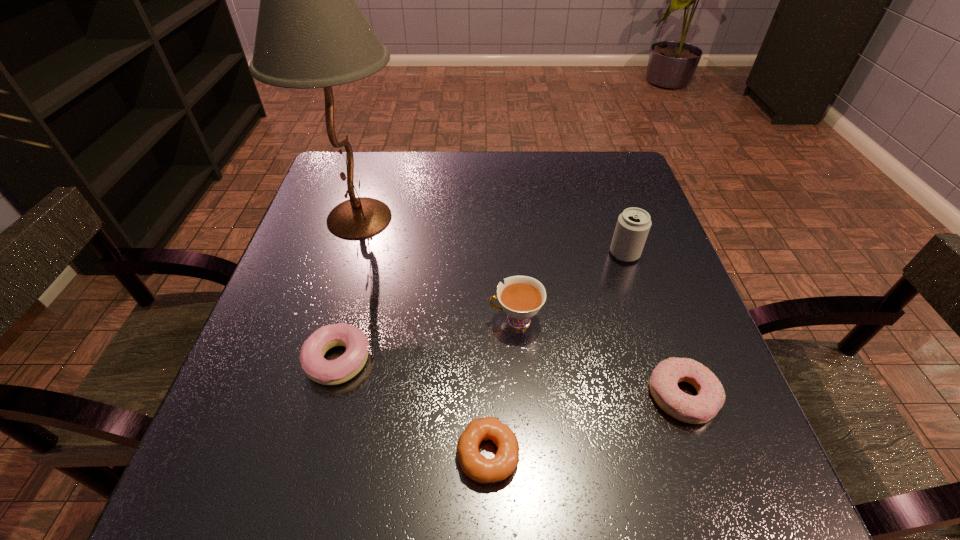
This screenshot has height=540, width=960. Find the location of `unoccupied position between the leftmost doughnut and the second doughnut from right to left`. unoccupied position between the leftmost doughnut and the second doughnut from right to left is located at coordinates (413, 408).

Find the location of a particular element. free spot between the second doughnut from left to right and the leftmost doughnut is located at coordinates (413, 408).

Identify the location of vacant area that lies between the second doughnut from right to left and the can. The width and height of the screenshot is (960, 540). (556, 354).

Identify the location of unoccupied position between the fourth shortest object and the table lamp. Image resolution: width=960 pixels, height=540 pixels. (438, 269).

This screenshot has width=960, height=540. In order to click on blank region between the teacup and the table lamp in this screenshot , I will do `click(438, 269)`.

Image resolution: width=960 pixels, height=540 pixels. What are the coordinates of `vacant area that lies between the fourth shortest object and the can` in the screenshot? It's located at (570, 287).

Where is `object that stands as the second closest to the rightmost doughnut`? object that stands as the second closest to the rightmost doughnut is located at coordinates (478, 468).

Locate an element on the screen. Image resolution: width=960 pixels, height=540 pixels. the second closest object to the leftmost doughnut is located at coordinates (521, 297).

Locate an element on the screen. The image size is (960, 540). doughnut that stands as the closest to the rightmost doughnut is located at coordinates (478, 468).

Select which doughnut is the closest to the fourth shortest object. Please provide its 2D coordinates. Your answer should be formatted as a tuple, i.e. [(x, y)], where the tuple contains the x and y coordinates of a point satisfying the conditions above.

[(478, 468)]